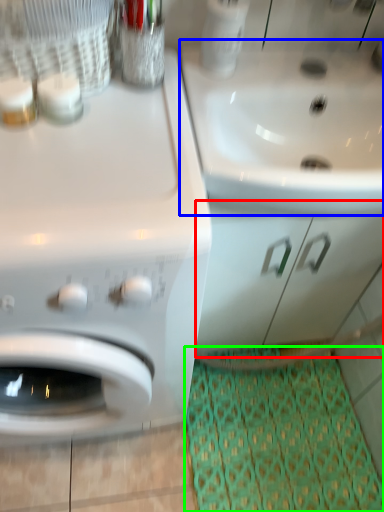
Question: Estimate the real-world distances between objects in this image. Which object is farther from drawer (highlighted by a red box), sink (highlighted by a blue box) or doormat (highlighted by a green box)?

Choices:
 (A) sink
 (B) doormat

Answer: (B)